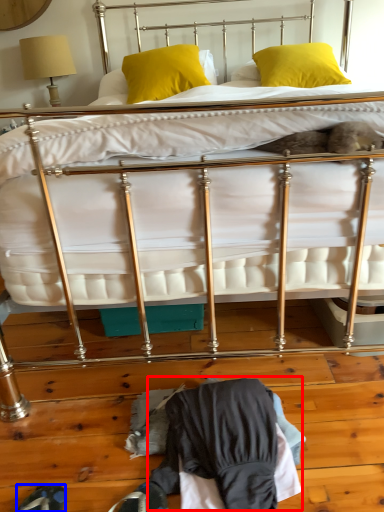
Question: Which object is closer to the camera taking this photo, clothing (highlighted by a red box) or footwear (highlighted by a blue box)?

Choices:
 (A) clothing
 (B) footwear

Answer: (B)